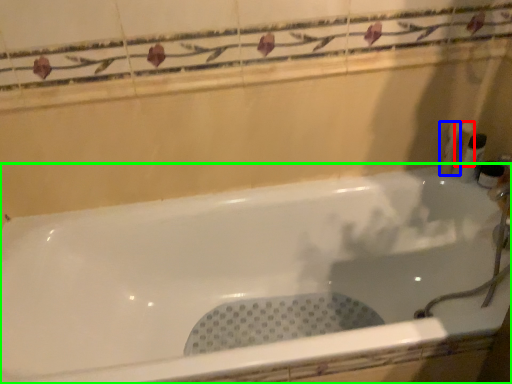
Question: Which object is the closest to the toiletry (highlighted by a red box)? Choose among these: toiletry (highlighted by a blue box) or bathtub (highlighted by a green box).

Choices:
 (A) toiletry
 (B) bathtub

Answer: (A)